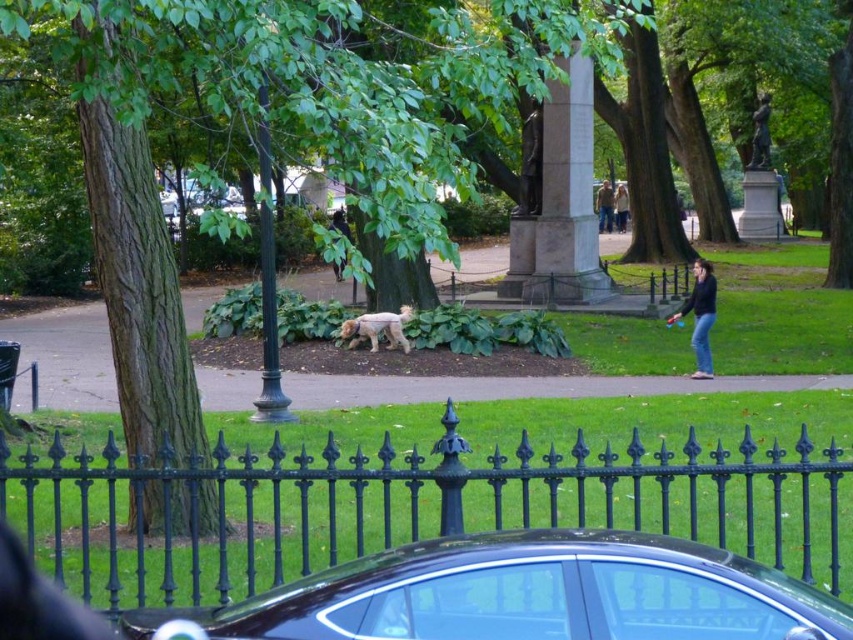
You are standing in the park and notice a black wrought iron fence at center and a brown leather jacket at center. Which object is taller?

The brown leather jacket at center is taller than the black wrought iron fence at center.